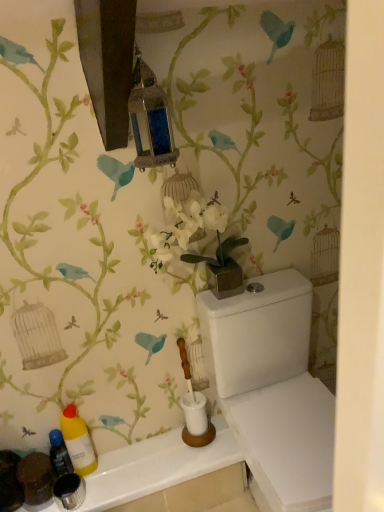
Where is `vacant area to the right of translucent plastic bottle at lower left, the first bottle viewed from the left`? The image size is (384, 512). vacant area to the right of translucent plastic bottle at lower left, the first bottle viewed from the left is located at coordinates (122, 470).